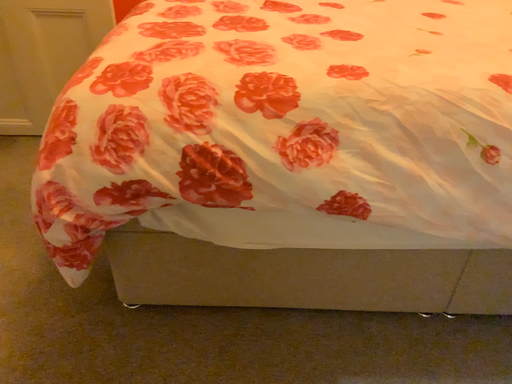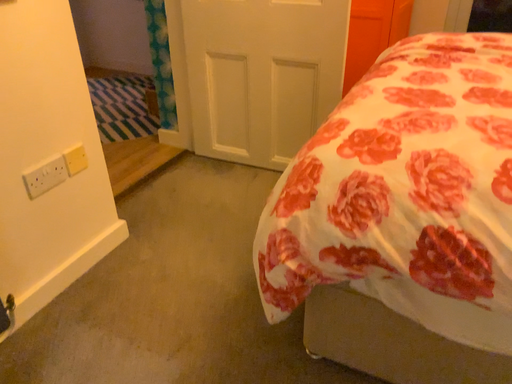
Question: Which way did the camera rotate in the video?

Choices:
 (A) rotated downward
 (B) rotated upward

Answer: (B)